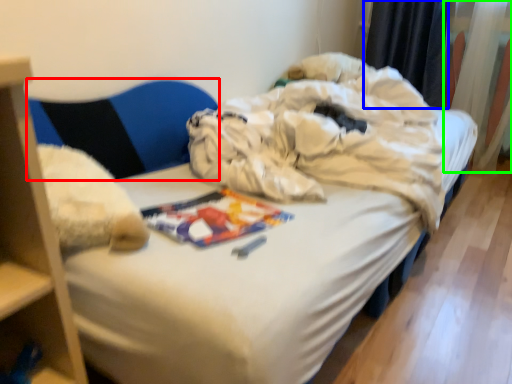
Question: Which object is the farthest from armchair (highlighted by a red box)? Choose among these: curtain (highlighted by a blue box) or curtain (highlighted by a green box).

Choices:
 (A) curtain
 (B) curtain

Answer: (B)